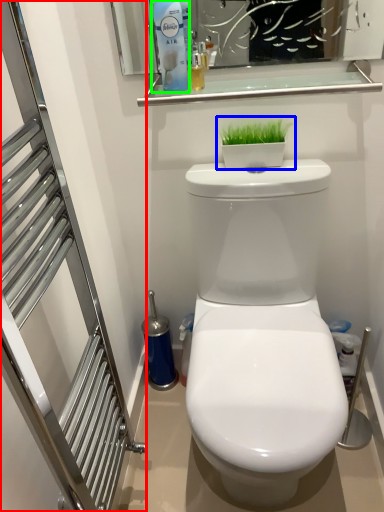
Question: Which object is positioned closest to screen door (highlighted by a red box)? Select from houseplant (highlighted by a blue box) and cleaning product (highlighted by a green box).

Choices:
 (A) houseplant
 (B) cleaning product

Answer: (B)